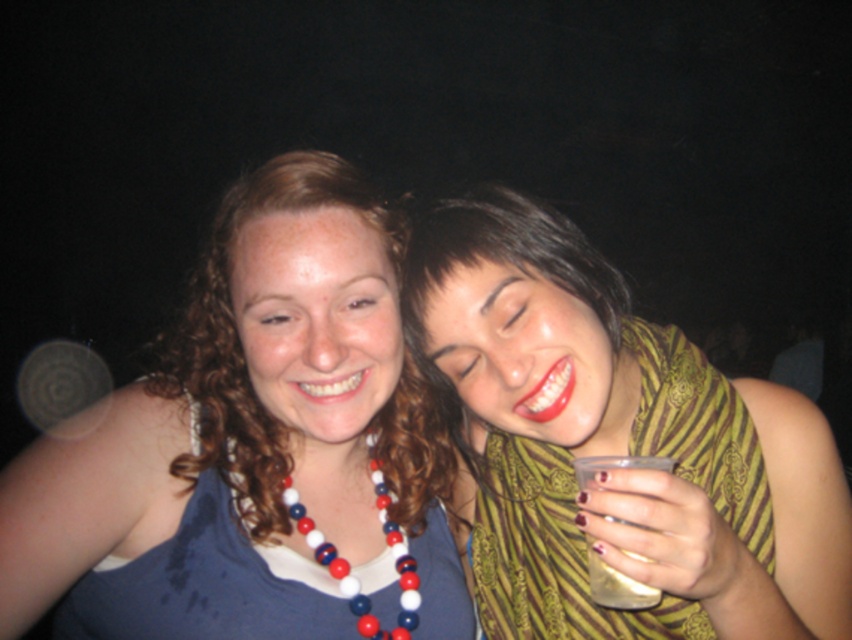
You are a photographer trying to capture a candid shot of both the green striped scarf at right and the red and white beads at center. The camera you are using has a maximum focus range of 25 centimeters. Can you fit both objects within the camera frame without moving the camera?

The green striped scarf at right and red and white beads at center are 24.18 centimeters apart from each other, so yes, the camera can capture both objects within its 25 centimeter focus range since the distance between them is less than the maximum range.

Consider the image. You are organizing a costume party and need to decide which accessory to place on a display stand. The green striped scarf at right and the red and white beads at center are both options. Which accessory will require a larger display stand due to its size?

The green striped scarf at right is bigger than the red and white beads at center, so it will require a larger display stand.